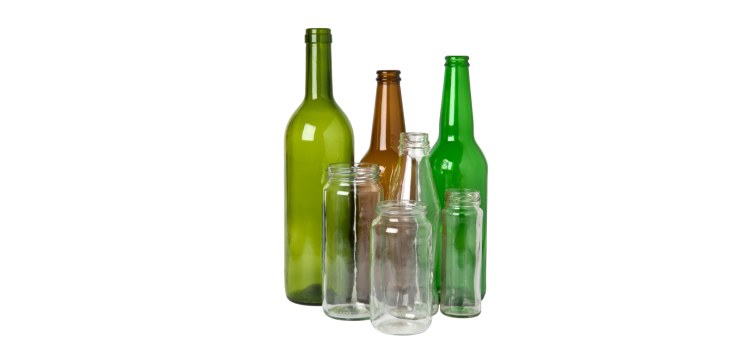
Where is `glass containers`? The width and height of the screenshot is (750, 350). glass containers is located at coordinates 320,148, 381,117, 453,107, 470,243, 414,188, 394,246, 350,221.